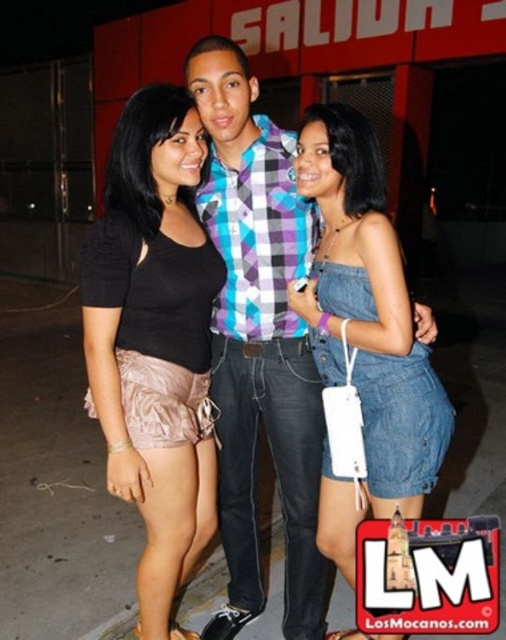
You are a photographer trying to frame a shot of the plaid shirt at center and the denim dress at center. Based on their positions, which clothing item is wider in the image?

The plaid shirt at center is wider than the denim dress at center according to the description.

You are a photographer trying to capture a group photo of the matte black top at center and the denim dress at center. Since you want to ensure both subjects are clearly visible, which clothing item should you focus on first to account for their size differences?

The matte black top at center has a lesser width compared to the denim dress at center, so you should focus on the denim dress at center first because it is wider and might require more attention to capture details properly.

You are organizing a charity event and need to determine which clothing items to donate based on their sizes. You see the plaid shirt at center and the denim dress at center in the image. Which clothing item is bigger in size?

The plaid shirt at center is larger in size than the denim dress at center, so the plaid shirt at center should be chosen if you need to donate the bigger item.